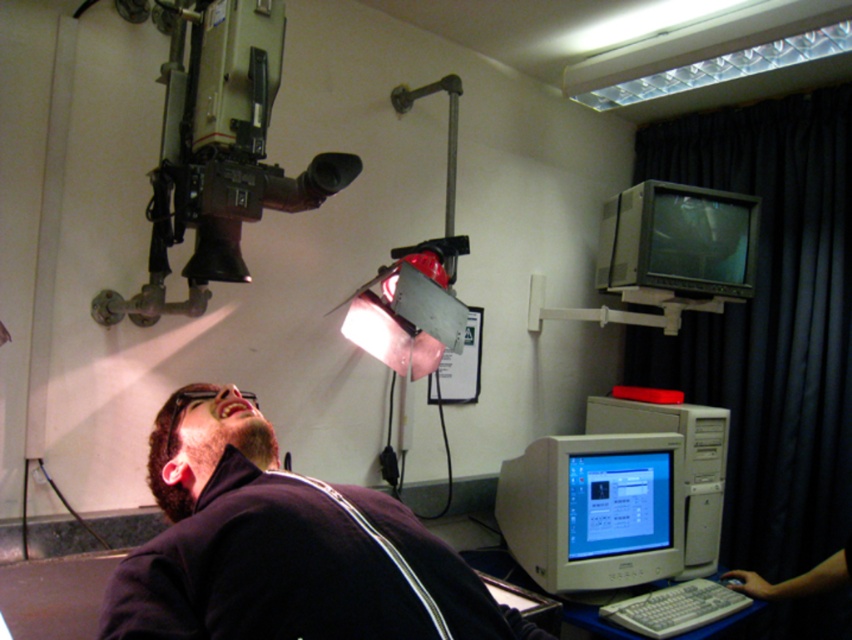
Is dark matte jacket at lower center above white plastic computer at lower right?

Yes, dark matte jacket at lower center is above white plastic computer at lower right.

Does dark matte jacket at lower center lie in front of white plastic computer at lower right?

Yes, it is.

Who is more distant from viewer, (400, 502) or (721, 460)?

Point (721, 460)

Where is `dark matte jacket at lower center`? The width and height of the screenshot is (852, 640). dark matte jacket at lower center is located at coordinates (283, 547).

Is dark matte jacket at lower center positioned at the back of metallic gray video camera at upper left?

No, dark matte jacket at lower center is in front of metallic gray video camera at upper left.

Find the location of a particular element. dark matte jacket at lower center is located at coordinates (283, 547).

Does point (159, 468) come in front of point (214, 109)?

Yes.

This screenshot has height=640, width=852. Find the location of `dark matte jacket at lower center`. dark matte jacket at lower center is located at coordinates (283, 547).

Can you confirm if metallic gray video camera at upper left is positioned below matte gray monitor at upper right?

No.

In the scene shown: Which is more to the left, metallic gray video camera at upper left or matte gray monitor at upper right?

Positioned to the left is metallic gray video camera at upper left.

I want to click on metallic gray video camera at upper left, so pyautogui.click(x=217, y=154).